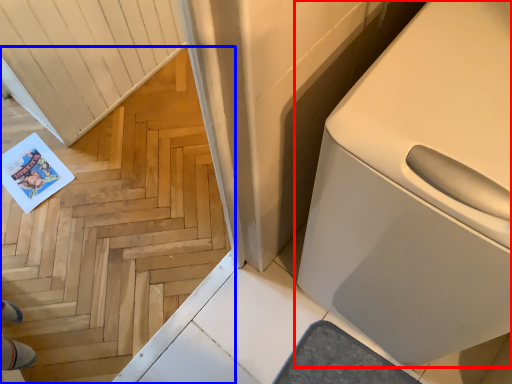
Question: Which object appears closest to the camera in this image, home appliance (highlighted by a red box) or stairwell (highlighted by a blue box)?

Choices:
 (A) home appliance
 (B) stairwell

Answer: (B)